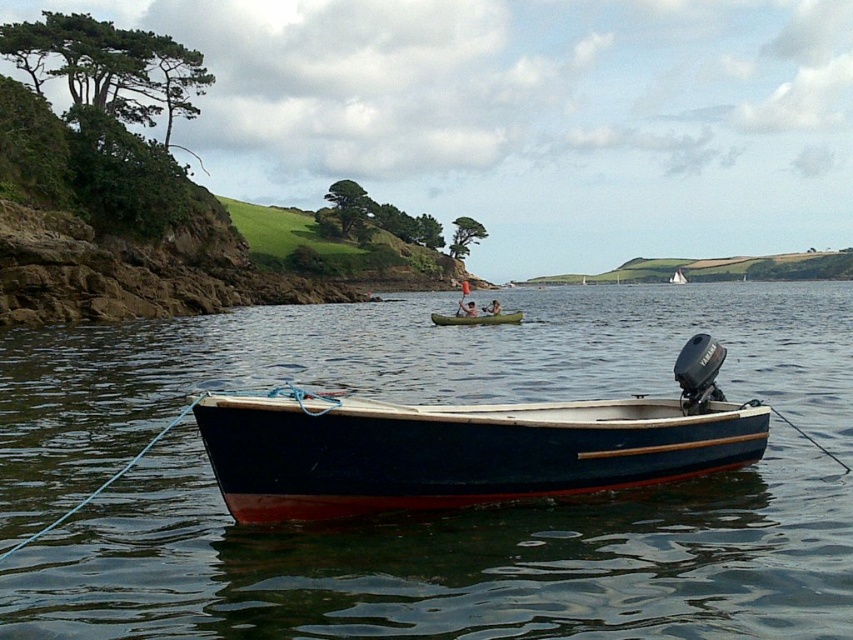
From the picture: Who is positioned more to the right, smooth dark blue water at center or dark blue polished wood boat at center?

From the viewer's perspective, smooth dark blue water at center appears more on the right side.

Does smooth dark blue water at center have a lesser width compared to dark blue polished wood boat at center?

No.

Between point (664, 355) and point (317, 477), which one is positioned in front?

Positioned in front is point (317, 477).

Identify the location of smooth dark blue water at center. The image size is (853, 640). coord(450,563).

Is point (404, 460) behind point (515, 323)?

No, (404, 460) is closer to viewer.

Is point (219, 484) positioned in front of point (450, 317)?

That is True.

Is point (550, 404) positioned before point (480, 314)?

Yes, it is.

The image size is (853, 640). I want to click on dark blue polished wood boat at center, so click(467, 445).

What do you see at coordinates (450, 563) in the screenshot? Image resolution: width=853 pixels, height=640 pixels. I see `smooth dark blue water at center` at bounding box center [450, 563].

Can you confirm if smooth dark blue water at center is taller than green plastic canoe at center?

Correct, smooth dark blue water at center is much taller as green plastic canoe at center.

I want to click on smooth dark blue water at center, so click(x=450, y=563).

Where is `smooth dark blue water at center`? smooth dark blue water at center is located at coordinates [x=450, y=563].